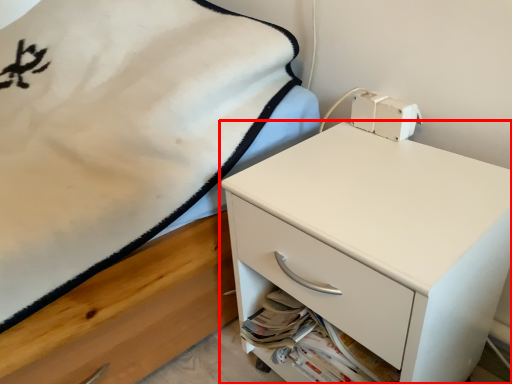
Question: From the image, what is the correct spatial relationship of chest of drawers (annotated by the red box) in relation to drawer?

Choices:
 (A) left
 (B) right

Answer: (B)